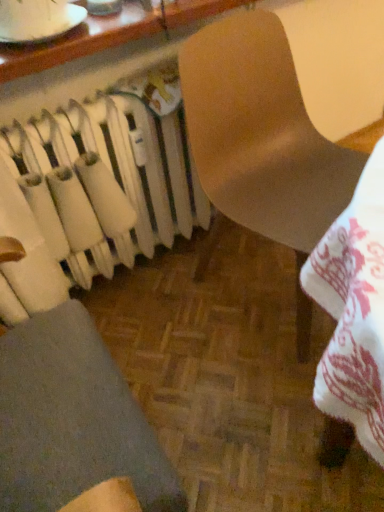
Question: Is matte brown chair at center further to camera compared to matte wooden table at upper center?

Choices:
 (A) no
 (B) yes

Answer: (A)

Question: Is matte brown chair at center directly adjacent to matte wooden table at upper center?

Choices:
 (A) no
 (B) yes

Answer: (A)

Question: Is matte brown chair at center to the left of matte wooden table at upper center from the viewer's perspective?

Choices:
 (A) no
 (B) yes

Answer: (A)

Question: Is there a large distance between matte brown chair at center and matte wooden table at upper center?

Choices:
 (A) yes
 (B) no

Answer: (B)

Question: From the image's perspective, would you say matte brown chair at center is shown under matte wooden table at upper center?

Choices:
 (A) no
 (B) yes

Answer: (B)

Question: Considering the relative sizes of matte brown chair at center and matte wooden table at upper center in the image provided, is matte brown chair at center smaller than matte wooden table at upper center?

Choices:
 (A) yes
 (B) no

Answer: (B)

Question: From a real-world perspective, is matte brown chair at center over white matte radiator at left?

Choices:
 (A) yes
 (B) no

Answer: (A)

Question: Does matte brown chair at center contain white matte radiator at left?

Choices:
 (A) yes
 (B) no

Answer: (B)

Question: Can you confirm if matte brown chair at center is thinner than white matte radiator at left?

Choices:
 (A) yes
 (B) no

Answer: (B)

Question: Does matte brown chair at center lie in front of white matte radiator at left?

Choices:
 (A) no
 (B) yes

Answer: (B)

Question: From the image's perspective, is matte brown chair at center located above white matte radiator at left?

Choices:
 (A) yes
 (B) no

Answer: (B)

Question: Is matte brown chair at center further to the viewer compared to white matte radiator at left?

Choices:
 (A) yes
 (B) no

Answer: (B)

Question: Considering the relative sizes of white matte radiator at left and matte brown chair at center in the image provided, is white matte radiator at left thinner than matte brown chair at center?

Choices:
 (A) yes
 (B) no

Answer: (A)